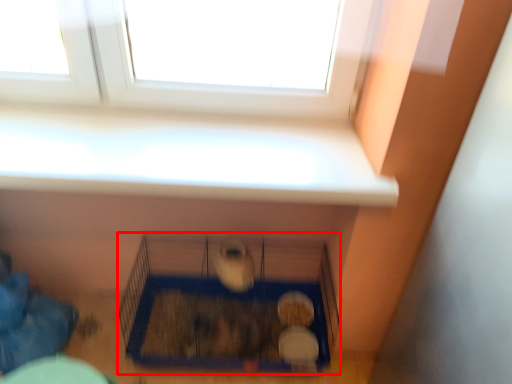
Question: From the image's perspective, what is the correct spatial positioning of bird cage (annotated by the red box) in reference to window?

Choices:
 (A) above
 (B) below

Answer: (B)